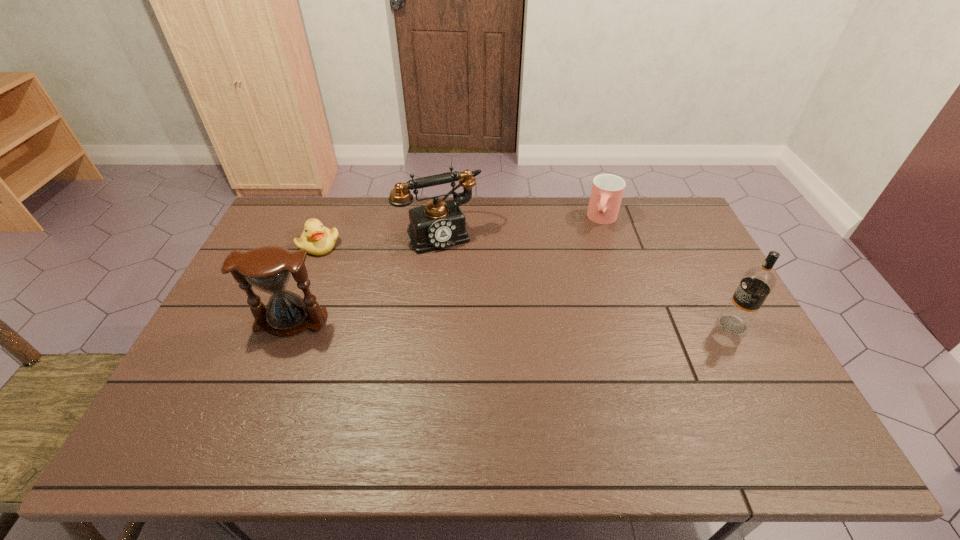
This screenshot has height=540, width=960. I want to click on object that can be found as the closest to the third object from right to left, so click(316, 239).

The height and width of the screenshot is (540, 960). I want to click on vacant space that satisfies the following two spatial constraints: 1. on the back side of the shortest object; 2. on the left side of the telephone, so click(324, 232).

At what (x,y) coordinates should I click in order to perform the action: click on free spot that satisfies the following two spatial constraints: 1. on the front side of the vodka; 2. on the label of the fourth tallest object. Please return your answer as a coordinate pair (x, y). This screenshot has height=540, width=960. Looking at the image, I should click on (638, 325).

Image resolution: width=960 pixels, height=540 pixels. I want to click on free point that satisfies the following two spatial constraints: 1. on the front side of the vodka; 2. on the label of the fourth object from left to right, so click(638, 325).

Identify the location of vacant space that satisfies the following two spatial constraints: 1. on the back side of the second shortest object; 2. on the right side of the hourglass. (332, 219).

Locate an element on the screen. This screenshot has width=960, height=540. free space that satisfies the following two spatial constraints: 1. on the front side of the rightmost object; 2. on the label of the fourth object from left to right is located at coordinates (638, 325).